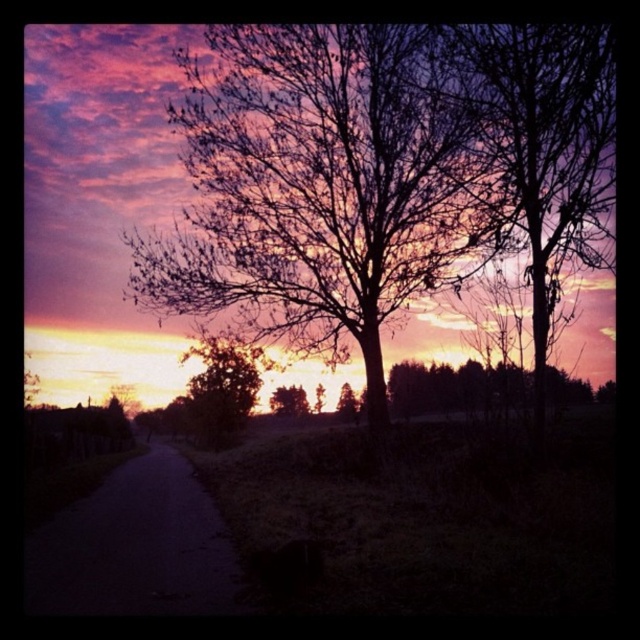
Question: Which point is closer to the camera?

Choices:
 (A) pos(278,396)
 (B) pos(168,272)
 (C) pos(563,192)

Answer: (C)

Question: Does silhouette leafless tree at center appear on the right side of bare branches at right?

Choices:
 (A) no
 (B) yes

Answer: (A)

Question: Which is farther from the green matte tree at center?

Choices:
 (A) bare branches at right
 (B) dark asphalt road at lower left
 (C) green leafy tree at lower left

Answer: (A)

Question: Which point is farther to the camera?

Choices:
 (A) silhouette leafless tree at center
 (B) green matte tree at center
 (C) green leafy tree at lower left

Answer: (B)

Question: Is bare branches at right wider than green matte tree at center?

Choices:
 (A) yes
 (B) no

Answer: (A)

Question: Is green leafy tree at lower left above green matte tree at center?

Choices:
 (A) yes
 (B) no

Answer: (A)